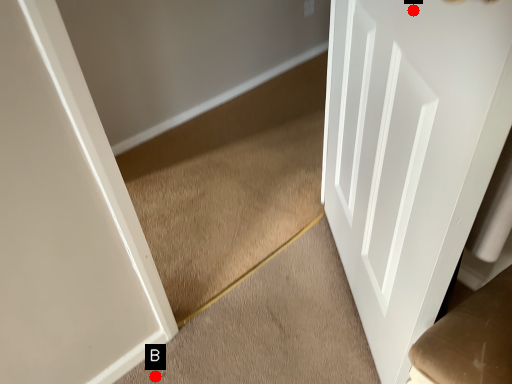
Question: Two points are circled on the image, labeled by A and B beside each circle. Which of the following is the closest to the observer?

Choices:
 (A) A is closer
 (B) B is closer

Answer: (A)